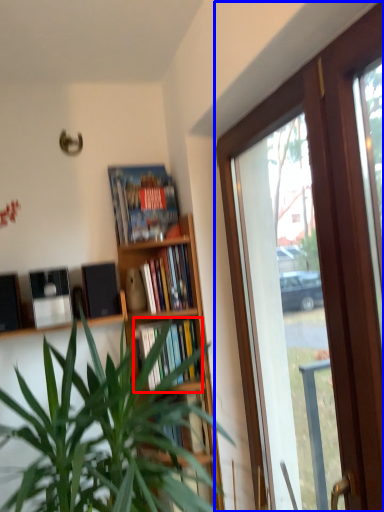
Question: Which point is closer to the camera, book (highlighted by a red box) or window (highlighted by a blue box)?

Choices:
 (A) book
 (B) window

Answer: (B)